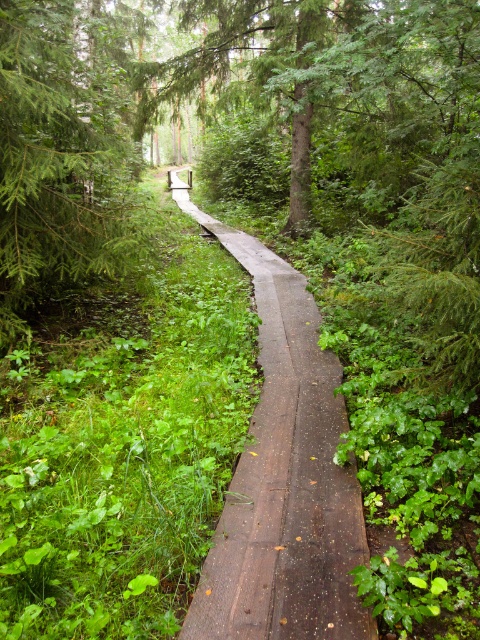
You are standing at the point marked as point [284,480] in the forest scene. What object is located exactly at that coordinate?

The brown wooden path at center is located exactly at point [284,480].

You are a hiker planning to walk along the brown wooden path at center and want to know if there is enough space to walk comfortably. Can you determine if the path is wider than the green matte tree at upper left?

The brown wooden path at center occupies less space than green matte tree at upper left, so the path is narrower than the tree. Therefore, there might not be enough space to walk comfortably.